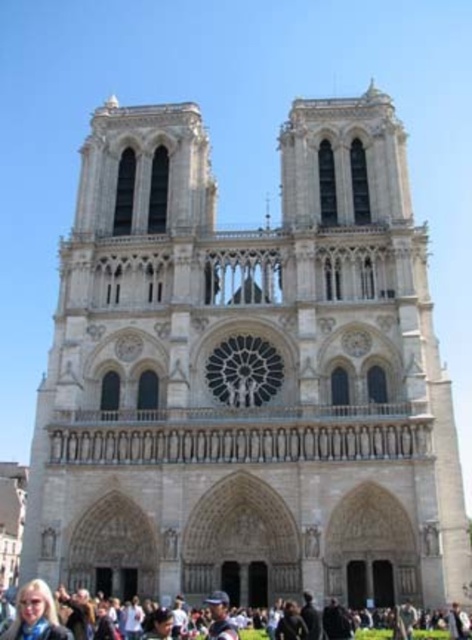
You are standing in front of the Notre Dame Cathedral and want to take a photo. You notice two points marked on the facade at coordinates point (89, 602) and point (17, 625). Which point is closer to you when you are facing the cathedral?

Point (89, 602) is further to the viewer than point (17, 625), so point (17, 625) is closer to you when facing the cathedral.

You are standing at the point marked by coordinates point (50, 616) in the image of Notre Dame Cathedral. What is the surface you are standing on?

The point (50, 616) is on the dark gray concrete crowd at lower center, so you are standing on the dark gray concrete crowd at lower center.